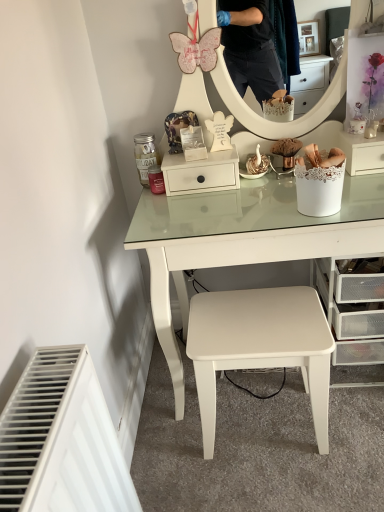
What are the coordinates of `white matte stool at center` in the screenshot? It's located at click(x=260, y=346).

Find the location of a particular element. The width and height of the screenshot is (384, 512). white matte drawer at center, positioned as the 1th shelf in left-to-right order is located at coordinates (201, 173).

Find the location of `white matte stool at center`. white matte stool at center is located at coordinates (260, 346).

Does point (379, 141) lie in front of point (219, 337)?

No, (379, 141) is further to viewer.

Between white lace-covered basket at right, which is the 1th shelf in right-to-left order, and white matte stool at center, which one is positioned in front?

white matte stool at center is more forward.

Where is `stool located in front of the white lace-covered basket at right, which is the 1th shelf in right-to-left order`? This screenshot has width=384, height=512. stool located in front of the white lace-covered basket at right, which is the 1th shelf in right-to-left order is located at coordinates (260, 346).

Considering the sizes of white lace-covered basket at right, which is the 1th shelf in right-to-left order, and white matte stool at center in the image, is white lace-covered basket at right, which is the 1th shelf in right-to-left order, bigger or smaller than white matte stool at center?

white lace-covered basket at right, which is the 1th shelf in right-to-left order, is smaller than white matte stool at center.

The width and height of the screenshot is (384, 512). Identify the location of stool on the right of the white matte drawer at center, positioned as the 1th shelf in left-to-right order. (260, 346).

From the picture: Measure the distance from white matte drawer at center, positioned as the 1th shelf in left-to-right order, to white matte stool at center.

A distance of 18.80 inches exists between white matte drawer at center, positioned as the 1th shelf in left-to-right order, and white matte stool at center.

Is white matte stool at center a part of white matte drawer at center, positioned as the 1th shelf in left-to-right order?

No, white matte stool at center is located outside of white matte drawer at center, positioned as the 1th shelf in left-to-right order.

Is white matte drawer at center, placed as the second shelf when sorted from right to left, facing away from white matte stool at center?

No, white matte drawer at center, placed as the second shelf when sorted from right to left, is not facing away from white matte stool at center.

Between white matte stool at center and white lace-covered basket at right, which is the 1th shelf in right-to-left order, which one has smaller width?

Thinner between the two is white lace-covered basket at right, which is the 1th shelf in right-to-left order.

Which object is more forward, white matte stool at center or white lace-covered basket at right, arranged as the second shelf when viewed from the left?

white matte stool at center is more forward.

From the image's perspective, is white matte drawer at center, placed as the second shelf when sorted from right to left, below white lace-covered basket at right, which is the 1th shelf in right-to-left order?

Yes, from the image's perspective, white matte drawer at center, placed as the second shelf when sorted from right to left, is below white lace-covered basket at right, which is the 1th shelf in right-to-left order.

From a real-world perspective, who is located higher, white matte drawer at center, placed as the second shelf when sorted from right to left, or white lace-covered basket at right, which is the 1th shelf in right-to-left order?

white matte drawer at center, placed as the second shelf when sorted from right to left.

In terms of height, does white lace-covered basket at right, arranged as the second shelf when viewed from the left, look taller or shorter compared to white matte drawer at center, placed as the second shelf when sorted from right to left?

Considering their sizes, white lace-covered basket at right, arranged as the second shelf when viewed from the left, has less height than white matte drawer at center, placed as the second shelf when sorted from right to left.

Is point (382, 141) closer or farther from the camera than point (166, 164)?

Point (382, 141) appears to be closer to the viewer than point (166, 164).

Considering their positions, is white lace-covered basket at right, which is the 1th shelf in right-to-left order, located in front of or behind white matte drawer at center, placed as the second shelf when sorted from right to left?

Clearly, white lace-covered basket at right, which is the 1th shelf in right-to-left order, is in front of white matte drawer at center, placed as the second shelf when sorted from right to left.

In the scene shown: How many degrees apart are the facing directions of white lace-covered basket at right, which is the 1th shelf in right-to-left order, and white matte drawer at center, placed as the second shelf when sorted from right to left?

The angle between the facing direction of white lace-covered basket at right, which is the 1th shelf in right-to-left order, and the facing direction of white matte drawer at center, placed as the second shelf when sorted from right to left, is 2.86 degrees.

From a real-world perspective, relative to white matte drawer at center, positioned as the 1th shelf in left-to-right order, is white matte stool at center vertically above or below?

From a real-world perspective, white matte stool at center is physically below white matte drawer at center, positioned as the 1th shelf in left-to-right order.

Is white matte stool at center smaller than white matte drawer at center, placed as the second shelf when sorted from right to left?

Actually, white matte stool at center might be larger than white matte drawer at center, placed as the second shelf when sorted from right to left.

Can you confirm if white matte stool at center is positioned to the left of white matte drawer at center, positioned as the 1th shelf in left-to-right order?

In fact, white matte stool at center is to the right of white matte drawer at center, positioned as the 1th shelf in left-to-right order.

Image resolution: width=384 pixels, height=512 pixels. Find the location of `stool lying in front of the white lace-covered basket at right, which is the 1th shelf in right-to-left order`. stool lying in front of the white lace-covered basket at right, which is the 1th shelf in right-to-left order is located at coordinates (260, 346).

From a real-world perspective, starting from the white matte stool at center, which shelf is the 2nd one vertically above it? Please provide its 2D coordinates.

[(201, 173)]

Considering their positions, is white matte drawer at center, positioned as the 1th shelf in left-to-right order, positioned further to white matte stool at center than white lace-covered basket at right, which is the 1th shelf in right-to-left order?

white lace-covered basket at right, which is the 1th shelf in right-to-left order.

Looking at the image, which one is located further to white lace-covered basket at right, arranged as the second shelf when viewed from the left, white matte stool at center or white matte drawer at center, placed as the second shelf when sorted from right to left?

The object further to white lace-covered basket at right, arranged as the second shelf when viewed from the left, is white matte stool at center.

Estimate the real-world distances between objects in this image. Which object is closer to white lace-covered basket at right, arranged as the second shelf when viewed from the left, white matte drawer at center, placed as the second shelf when sorted from right to left, or white matte stool at center?

white matte drawer at center, placed as the second shelf when sorted from right to left, is closer to white lace-covered basket at right, arranged as the second shelf when viewed from the left.

When comparing their distances from white matte drawer at center, positioned as the 1th shelf in left-to-right order, does white lace-covered basket at right, which is the 1th shelf in right-to-left order, or white matte stool at center seem further?

Based on the image, white matte stool at center appears to be further to white matte drawer at center, positioned as the 1th shelf in left-to-right order.

Based on their spatial positions, is white lace-covered basket at right, arranged as the second shelf when viewed from the left, or white matte drawer at center, positioned as the 1th shelf in left-to-right order, closer to white matte stool at center?

white matte drawer at center, positioned as the 1th shelf in left-to-right order, is positioned closer to the anchor white matte stool at center.

Estimate the real-world distances between objects in this image. Which object is closer to white matte drawer at center, positioned as the 1th shelf in left-to-right order, white matte stool at center or white lace-covered basket at right, which is the 1th shelf in right-to-left order?

white lace-covered basket at right, which is the 1th shelf in right-to-left order, lies closer to white matte drawer at center, positioned as the 1th shelf in left-to-right order, than the other object.

Find the location of a particular element. shelf between white lace-covered basket at right, arranged as the second shelf when viewed from the left, and white matte stool at center vertically is located at coordinates (201, 173).